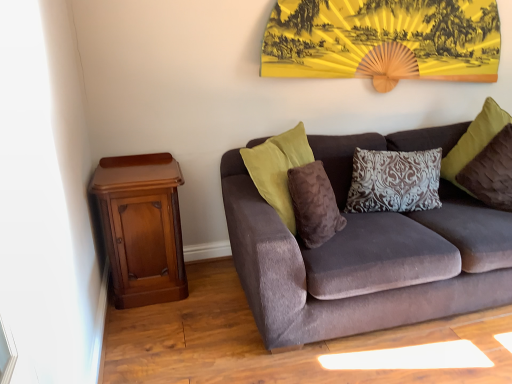
In order to click on free spot in front of mahogany wood nightstand at left in this screenshot , I will do `click(154, 334)`.